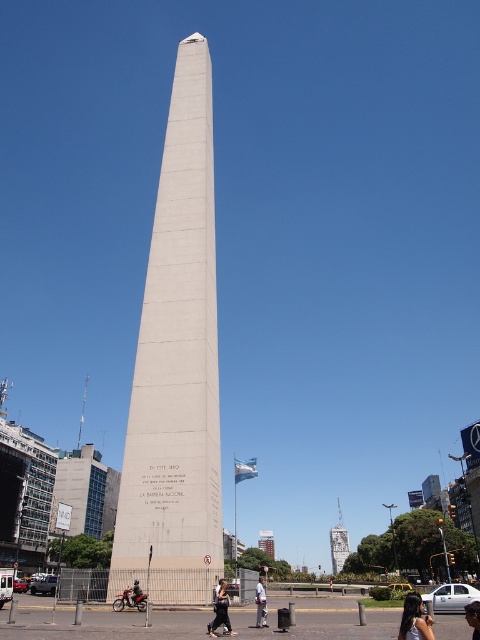
Question: Which object is the farthest from the black fabric pants at lower center?

Choices:
 (A) white concrete obelisk at center
 (B) white concrete tower at center
 (C) dark brown hair at lower right
 (D) dark hair at center

Answer: (B)

Question: Among these objects, which one is nearest to the camera?

Choices:
 (A) dark hair at center
 (B) white concrete tower at center
 (C) white cotton shirt at center
 (D) dark brown hair at lower right

Answer: (A)

Question: Does white concrete obelisk at center have a smaller size compared to dark hair at center?

Choices:
 (A) yes
 (B) no

Answer: (B)

Question: Which point is farther to the camera?

Choices:
 (A) black fabric pants at lower center
 (B) dark hair at center

Answer: (A)

Question: Does white concrete obelisk at center appear on the right side of dark hair at center?

Choices:
 (A) no
 (B) yes

Answer: (A)

Question: Does white concrete tower at center have a lesser width compared to black fabric pants at lower center?

Choices:
 (A) no
 (B) yes

Answer: (A)